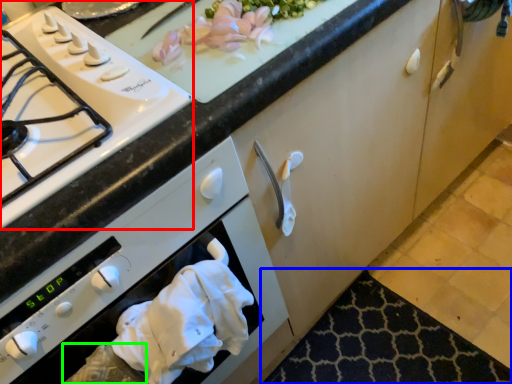
Question: Which object is the farthest from gas stove (highlighted by a red box)? Choose among these: mat (highlighted by a blue box) or hand (highlighted by a green box).

Choices:
 (A) mat
 (B) hand

Answer: (A)